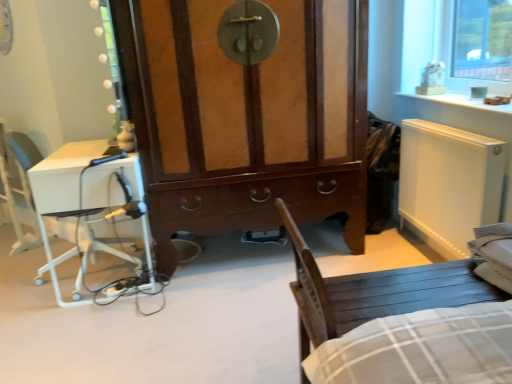
I want to click on vacant area on top of white matte radiator at right (from a real-world perspective), so click(448, 127).